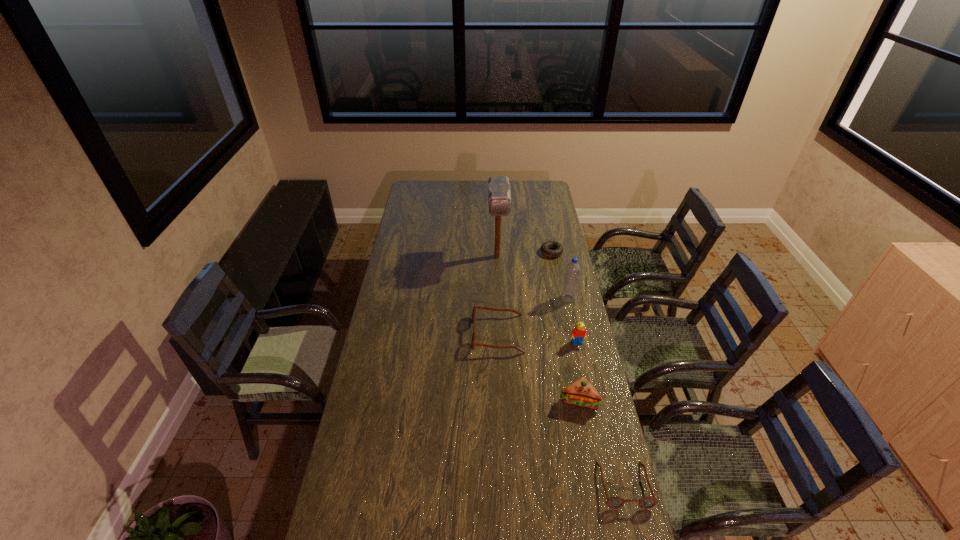
This screenshot has height=540, width=960. What are the coordinates of `spectacles present at the right edge` in the screenshot? It's located at (616, 502).

Identify the location of doughnut situated at the right edge. The image size is (960, 540). (546, 247).

Locate an element on the screen. The height and width of the screenshot is (540, 960). sandwich at the right edge is located at coordinates (581, 393).

Find the location of a particular element. Image resolution: width=960 pixels, height=540 pixels. water bottle located in the right edge section of the desktop is located at coordinates (573, 268).

Locate an element on the screen. The width and height of the screenshot is (960, 540). Lego that is at the right edge is located at coordinates (579, 332).

Where is `object present at the near right corner`? Image resolution: width=960 pixels, height=540 pixels. object present at the near right corner is located at coordinates (616, 502).

Identify the location of free spot at the far edge of the desktop. (463, 195).

In order to click on vacant space at the near edge in this screenshot , I will do `click(533, 514)`.

Locate an element on the screen. This screenshot has width=960, height=540. vacant space at the left edge is located at coordinates (388, 304).

The width and height of the screenshot is (960, 540). Find the location of `vacant space at the right edge of the desktop`. vacant space at the right edge of the desktop is located at coordinates (536, 209).